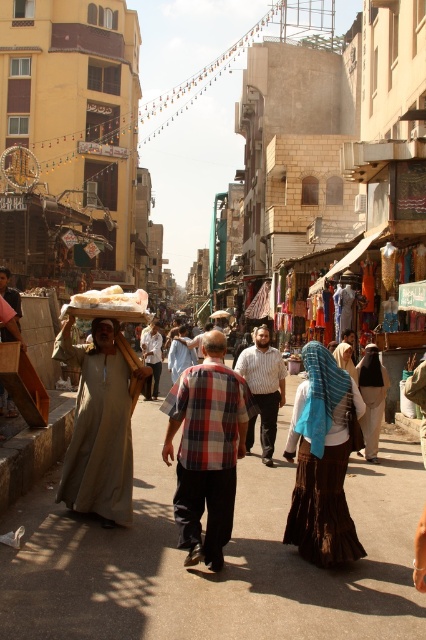
Question: Estimate the real-world distances between objects in this image. Which object is farther from the plaid shirt at center?

Choices:
 (A) white cotton headscarf at center
 (B) brown woven skirt at lower center
 (C) beige cotton robe at left

Answer: (A)

Question: Among these objects, which one is farthest from the camera?

Choices:
 (A) beige cotton robe at left
 (B) white cotton headscarf at center
 (C) plaid cotton shirt at center
 (D) brown woven skirt at lower center

Answer: (B)

Question: Is brown woven skirt at lower center wider than plaid shirt at center?

Choices:
 (A) no
 (B) yes

Answer: (A)

Question: Does plaid cotton shirt at center appear on the left side of striped cotton shirt at center?

Choices:
 (A) no
 (B) yes

Answer: (B)

Question: Which object is positioned closest to the plaid shirt at center?

Choices:
 (A) beige cotton robe at left
 (B) white cotton headscarf at center

Answer: (A)

Question: Considering the relative positions of white cotton headscarf at center and plaid shirt at center in the image provided, where is white cotton headscarf at center located with respect to plaid shirt at center?

Choices:
 (A) left
 (B) right

Answer: (B)